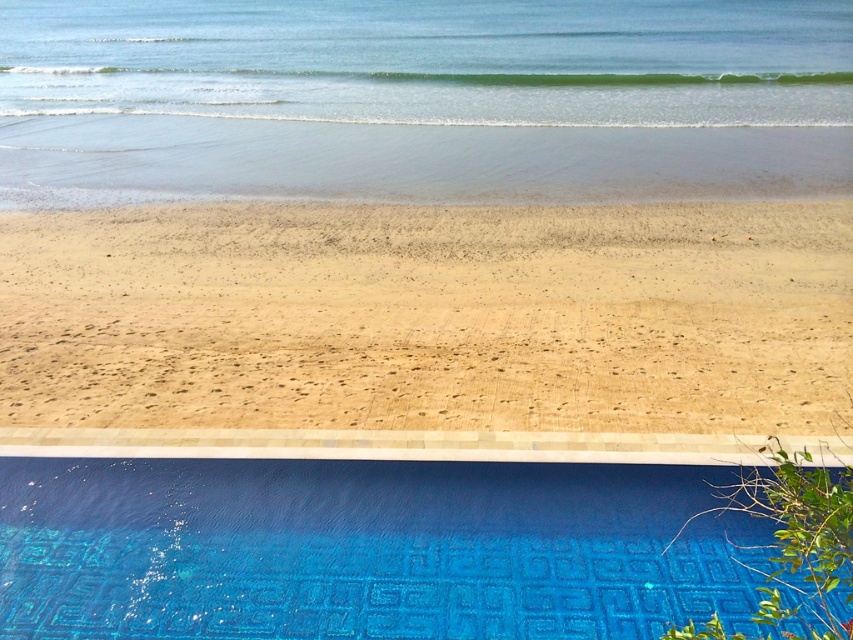
You are designing a safety sign for the pool area and need to know the relative sizes of the blue glossy tile at lower center and the clear blue water at upper center. Which object is thinner?

The blue glossy tile at lower center is thinner than the clear blue water at upper center according to the description.

You are standing at the point closest to the ocean in this coastal scene. Which of the two points, point 1 at coordinates point (100, 285) or point 2 at coordinates point (567, 20), is closer to you?

Point 1 at coordinates point (100, 285) is closer to you because it is in front of point 2 at coordinates point (567, 20).

You are standing at the edge of the pool and want to walk to the point marked as point (738, 250) and then to point (723, 566). Which point will you reach first?

You will reach point (738, 250) first because it is closer to you than point (723, 566), which is further away.